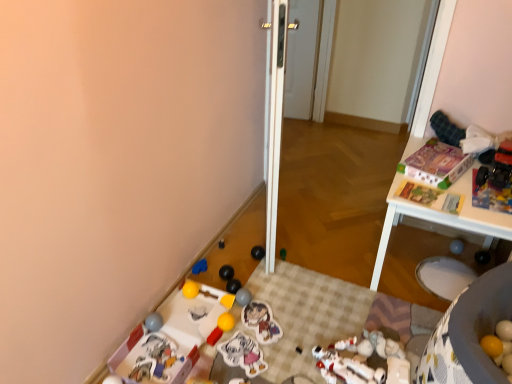
Image resolution: width=512 pixels, height=384 pixels. Identify the location of free space on the front side of yellow matte toy at lower center, which is counted as the eighth toy, starting from the left. (225, 336).